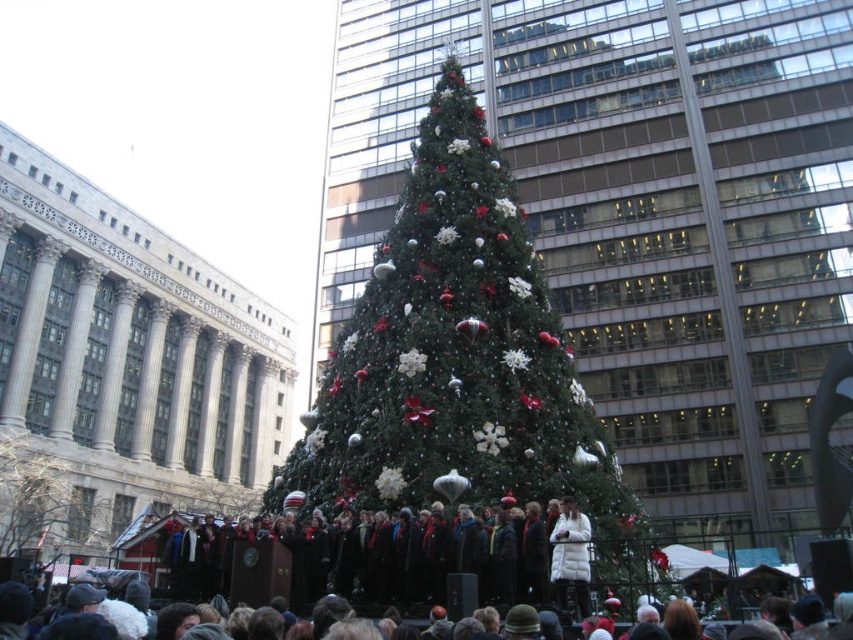
Is green matte christmas tree at center wider than white puffy coat at center?

Correct, the width of green matte christmas tree at center exceeds that of white puffy coat at center.

Describe the element at coordinates (45, 500) in the screenshot. I see `green matte christmas tree at center` at that location.

Between point (30, 436) and point (577, 600), which one is positioned in front?

Positioned in front is point (577, 600).

Where is `green matte christmas tree at center`? green matte christmas tree at center is located at coordinates (45, 500).

Does green textured christmas tree at center have a lesser height compared to green matte christmas tree at center?

No.

Where is `green textured christmas tree at center`? The width and height of the screenshot is (853, 640). green textured christmas tree at center is located at coordinates (461, 362).

Who is more distant from viewer, (x=354, y=380) or (x=16, y=474)?

The point (x=16, y=474) is behind.

Where is `green textured christmas tree at center`? green textured christmas tree at center is located at coordinates (461, 362).

Is dark brown hair at lower center positioned before white puffy coat at center?

That is True.

Which is below, dark brown hair at lower center or white puffy coat at center?

white puffy coat at center

The image size is (853, 640). Find the location of `dark brown hair at lower center`. dark brown hair at lower center is located at coordinates (15, 609).

Locate an element on the screen. The width and height of the screenshot is (853, 640). dark brown hair at lower center is located at coordinates (15, 609).